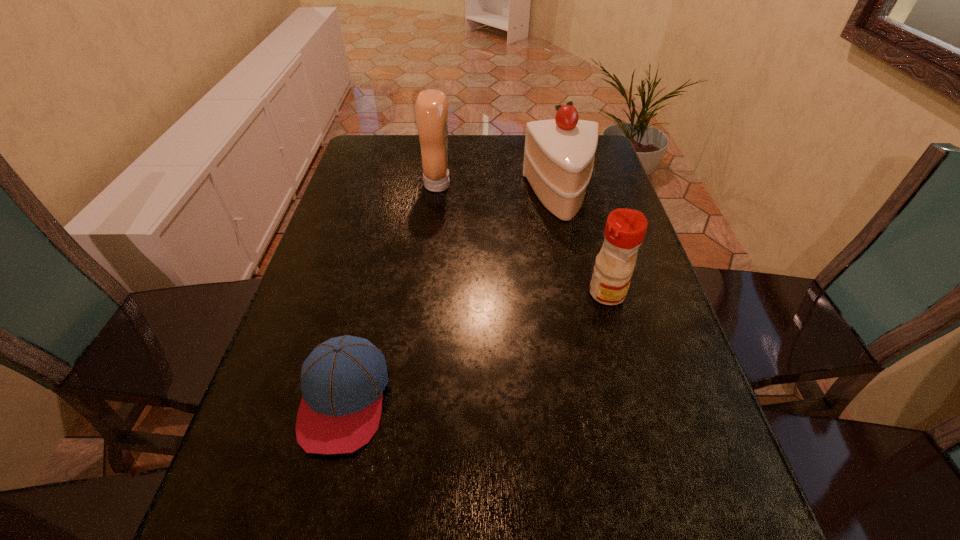
Find the location of `free space that is in between the nearest object and the cake`. free space that is in between the nearest object and the cake is located at coordinates [452, 298].

Identify the location of vacant space that is in between the farther condiment and the cake. The height and width of the screenshot is (540, 960). (499, 191).

The image size is (960, 540). In order to click on free space between the nearest object and the second object from left to right in this screenshot , I will do pos(391,292).

Locate an element on the screen. vacant space that's between the cake and the leftmost object is located at coordinates (452, 298).

Find the location of a particular element. This screenshot has width=960, height=540. vacant area between the nearest object and the cake is located at coordinates [452, 298].

At what (x,y) coordinates should I click in order to perform the action: click on free space between the baseball cap and the shorter condiment. Please return your answer as a coordinate pair (x, y). The image size is (960, 540). Looking at the image, I should click on (475, 346).

Find the location of a particular element. Image resolution: width=960 pixels, height=540 pixels. empty space between the farther condiment and the cake is located at coordinates (499, 191).

At what (x,y) coordinates should I click in order to perform the action: click on free spot between the leftmost object and the cake. Please return your answer as a coordinate pair (x, y). The height and width of the screenshot is (540, 960). Looking at the image, I should click on (452, 298).

Locate an element on the screen. Image resolution: width=960 pixels, height=540 pixels. vacant space that's between the shortest object and the farther condiment is located at coordinates 391,292.

Choose which object is the nearest neighbor to the cake. Please provide its 2D coordinates. Your answer should be formatted as a tuple, i.e. [(x, y)], where the tuple contains the x and y coordinates of a point satisfying the conditions above.

[(431, 108)]